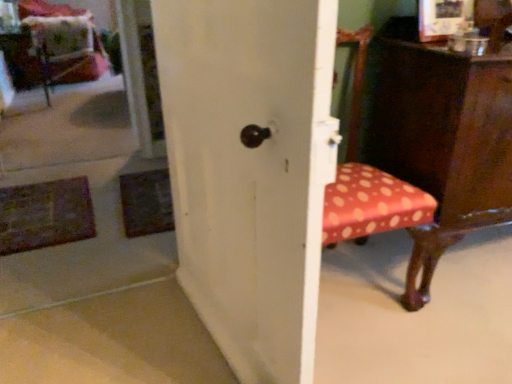
Identify the location of blank space to the left of white matte door at center. Image resolution: width=512 pixels, height=384 pixels. (125, 344).